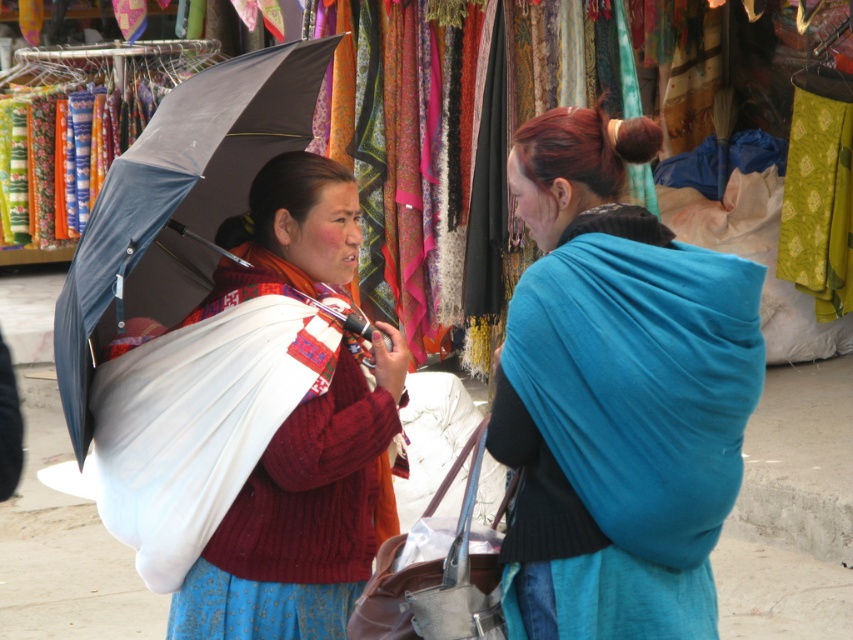
Question: Which object is the farthest from the matte white shawl at center?

Choices:
 (A) dark gray fabric umbrella at left
 (B) matte blue shawl at center

Answer: (B)

Question: Which point is closer to the camera?

Choices:
 (A) (218, 538)
 (B) (248, 60)
 (C) (550, 605)

Answer: (C)

Question: Does matte blue shawl at center appear on the left side of dark gray fabric umbrella at left?

Choices:
 (A) no
 (B) yes

Answer: (A)

Question: Does matte white shawl at center appear over dark gray fabric umbrella at left?

Choices:
 (A) no
 (B) yes

Answer: (A)

Question: Which is nearer to the dark gray fabric umbrella at left?

Choices:
 (A) matte blue shawl at center
 (B) matte white shawl at center

Answer: (B)

Question: Is matte blue shawl at center to the right of dark gray fabric umbrella at left from the viewer's perspective?

Choices:
 (A) yes
 (B) no

Answer: (A)